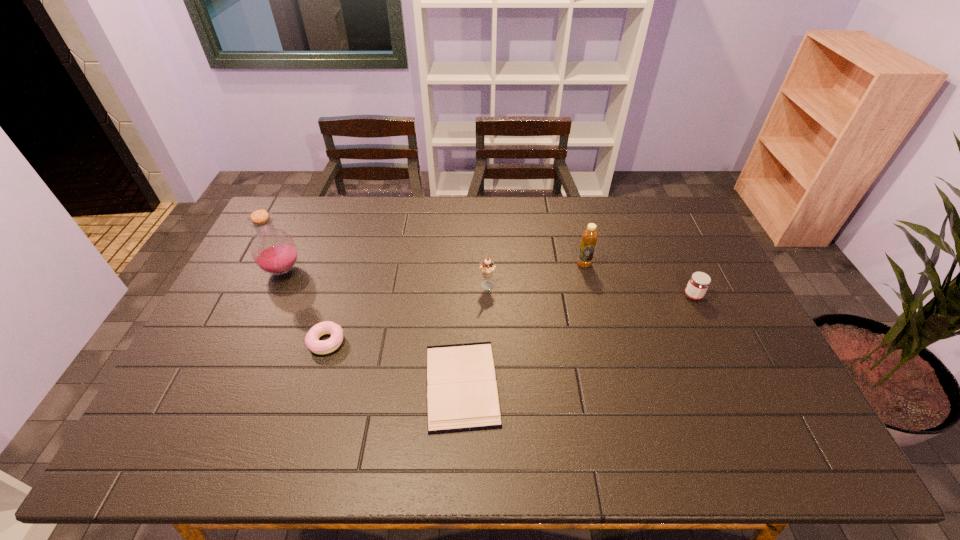
This screenshot has height=540, width=960. Identify the location of the taller bottle. (273, 250).

Locate an element on the screen. This screenshot has height=540, width=960. the left bottle is located at coordinates (273, 250).

The image size is (960, 540). Identify the location of the fifth object from left to right. (589, 237).

I want to click on the right bottle, so click(589, 237).

Where is `the third tallest object`? the third tallest object is located at coordinates (487, 267).

In order to click on jam in this screenshot , I will do `click(699, 282)`.

In order to click on the rightmost object in this screenshot , I will do `click(699, 282)`.

Find the location of a particular element. The width and height of the screenshot is (960, 540). the second shortest object is located at coordinates (312, 341).

Find the location of a particular element. doughnut is located at coordinates (312, 341).

Identify the location of the shortest object. This screenshot has height=540, width=960. (462, 395).